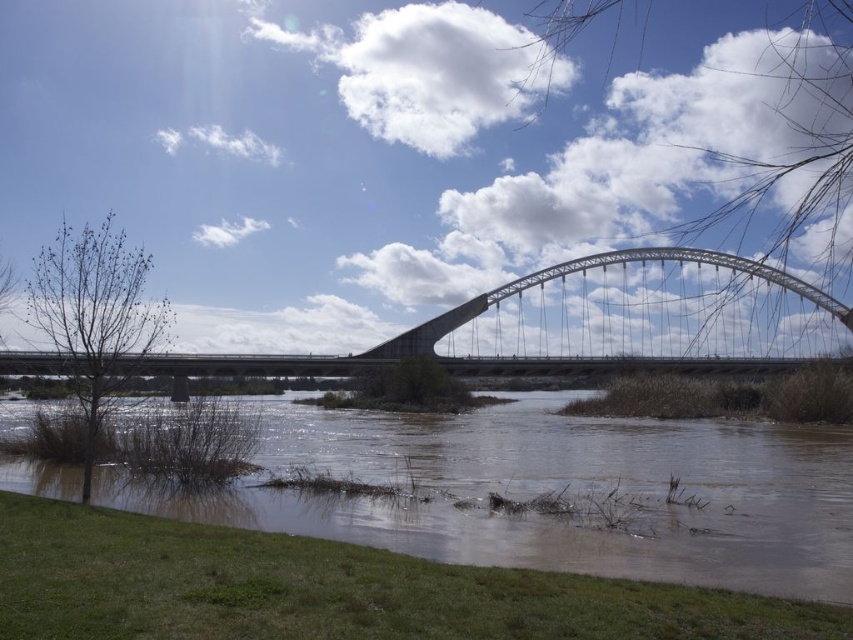
Does brown muddy water at lower center appear on the left side of metallic gray arch bridge at center?

Yes, brown muddy water at lower center is to the left of metallic gray arch bridge at center.

Which is behind, point (711, 470) or point (457, 307)?

Point (457, 307)

Which is in front, point (502, 435) or point (402, 332)?

Point (502, 435)

Where is `brown muddy water at lower center`? The width and height of the screenshot is (853, 640). brown muddy water at lower center is located at coordinates (553, 490).